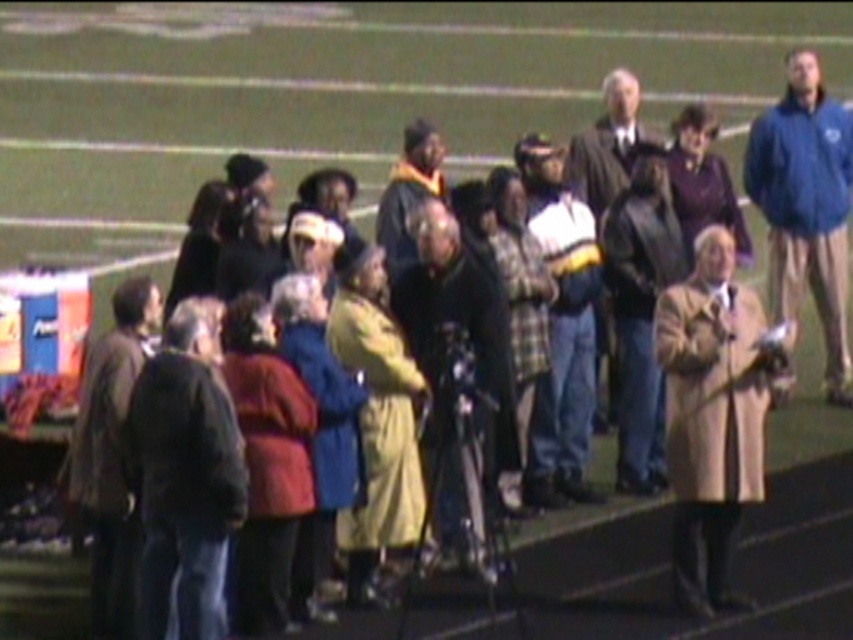
Which is more to the left, blue fleece jacket at upper right or plaid fabric jacket at center?

Positioned to the left is plaid fabric jacket at center.

Who is positioned more to the right, blue fleece jacket at upper right or plaid fabric jacket at center?

From the viewer's perspective, blue fleece jacket at upper right appears more on the right side.

I want to click on blue fleece jacket at upper right, so click(805, 208).

The image size is (853, 640). In order to click on blue fleece jacket at upper right in this screenshot , I will do `click(805, 208)`.

Does black leather jacket at center have a smaller size compared to matte black coat at center?

No, black leather jacket at center is not smaller than matte black coat at center.

Can you confirm if black leather jacket at center is thinner than matte black coat at center?

In fact, black leather jacket at center might be wider than matte black coat at center.

Is point (519, 454) positioned in front of point (634, 145)?

Yes.

This screenshot has width=853, height=640. I want to click on black leather jacket at center, so click(x=466, y=332).

Can you confirm if brown leather jacket at left is thinner than matte black graduation gown at center?

No.

In the scene shown: Which of these two, brown leather jacket at left or matte black graduation gown at center, stands shorter?

matte black graduation gown at center is shorter.

Does point (161, 310) come farther from viewer compared to point (422, 154)?

That is False.

I want to click on brown leather jacket at left, so coord(111,452).